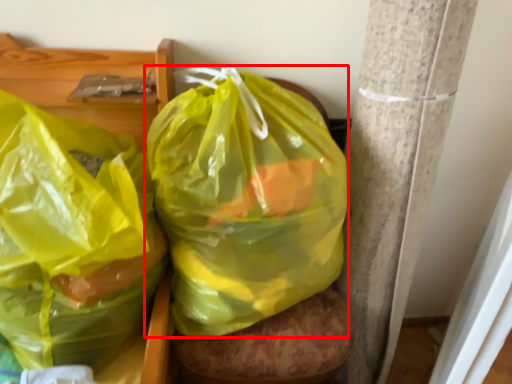
Question: From the image's perspective, where is plastic bag (annotated by the red box) located relative to plastic bag?

Choices:
 (A) below
 (B) above

Answer: (B)